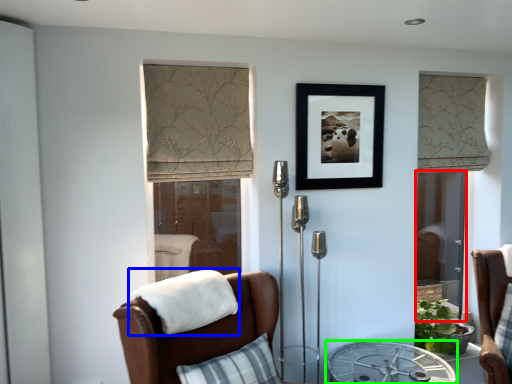
Question: Considering the real-world distances, which object is farthest from screen door (highlighted by a red box)? blanket (highlighted by a blue box) or table (highlighted by a green box)?

Choices:
 (A) blanket
 (B) table

Answer: (A)